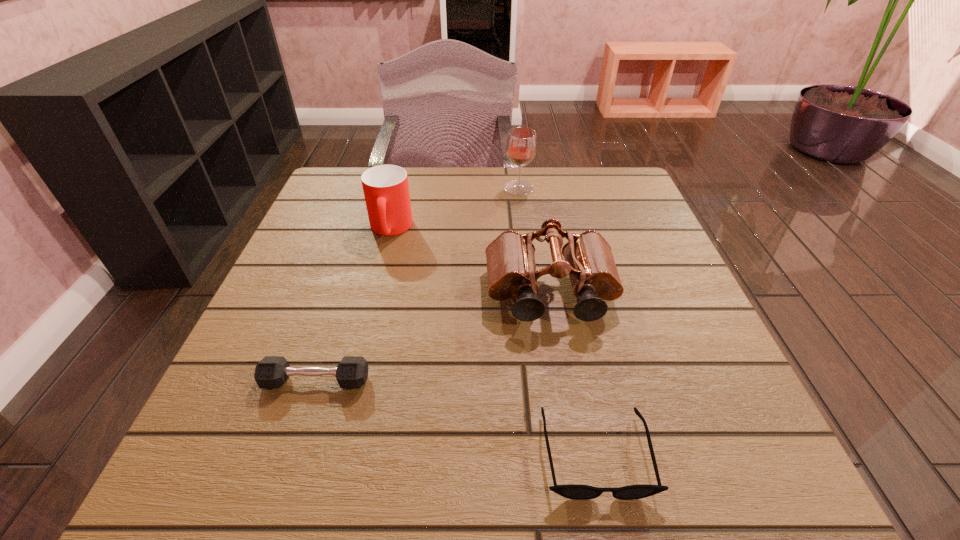
Locate an element on the screen. Image resolution: width=960 pixels, height=540 pixels. free region located 0.170m through the eyepieces of the third farthest object is located at coordinates (571, 417).

At what (x,y) coordinates should I click in order to perform the action: click on vacant space located on the right of the dumbbell. Please return your answer as a coordinate pair (x, y). This screenshot has width=960, height=540. Looking at the image, I should click on (426, 381).

You are a GUI agent. You are given a task and a screenshot of the screen. Output one action in this format:
    pyautogui.click(x=<x>, y=<y>)
    Task: Click on the wineglass at the far edge
    Image resolution: width=960 pixels, height=540 pixels.
    Given the screenshot: What is the action you would take?
    pyautogui.click(x=521, y=146)

In order to click on cup situated at the far edge in this screenshot , I will do `click(386, 190)`.

In order to click on object located at the near edge in this screenshot , I will do `click(573, 491)`.

Image resolution: width=960 pixels, height=540 pixels. What are the coordinates of `cup located in the left edge section of the desktop` in the screenshot? It's located at (386, 190).

What are the coordinates of `dumbbell that is positioned at the left edge` in the screenshot? It's located at (271, 372).

This screenshot has width=960, height=540. What are the coordinates of `object that is at the right edge` in the screenshot? It's located at (511, 269).

Where is `object positioned at the far left corner`? This screenshot has width=960, height=540. object positioned at the far left corner is located at coordinates (386, 190).

Locate an element on the screen. free space at the far edge of the desktop is located at coordinates (550, 187).